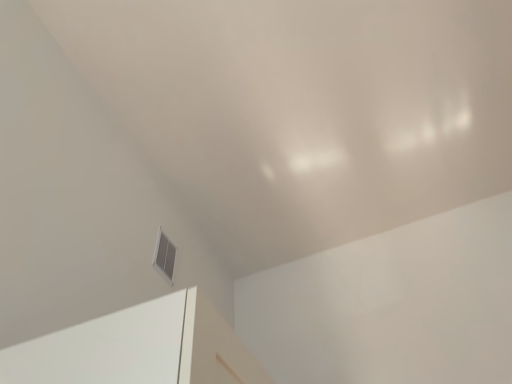
This screenshot has height=384, width=512. I want to click on white textured vent at upper center, so click(x=164, y=256).

Describe the element at coordinates (164, 256) in the screenshot. This screenshot has height=384, width=512. I see `white textured vent at upper center` at that location.

This screenshot has width=512, height=384. I want to click on white textured vent at upper center, so click(x=164, y=256).